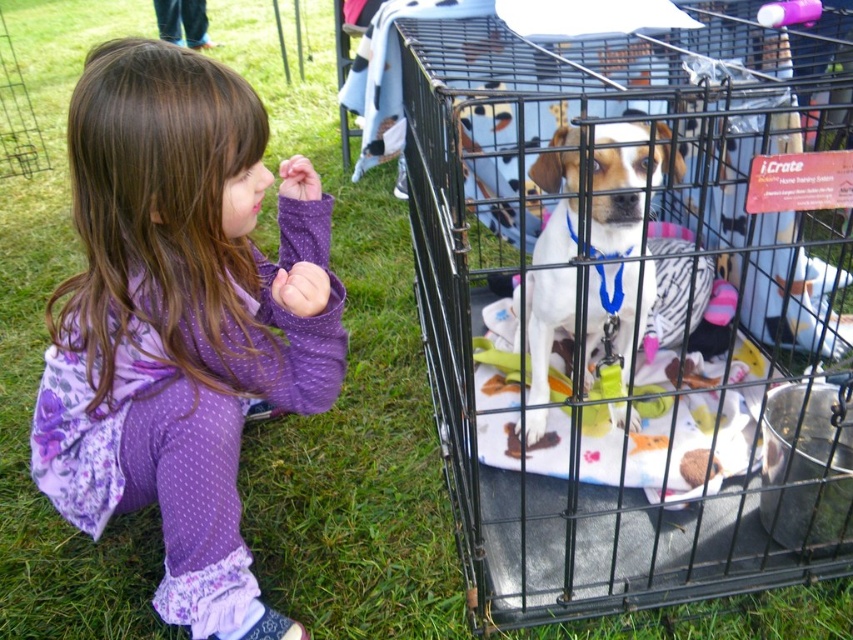
Question: Estimate the real-world distances between objects in this image. Which object is closer to the black wire cage at center?

Choices:
 (A) white fur dog at center
 (B) purple polka dot dress at lower left

Answer: (A)

Question: Which point is closer to the camera?

Choices:
 (A) black wire cage at center
 (B) white fur dog at center
 (C) purple polka dot dress at lower left

Answer: (A)

Question: Which point is farther from the camera taking this photo?

Choices:
 (A) (250, 384)
 (B) (642, 168)

Answer: (B)

Question: Considering the relative positions of black wire cage at center and white fur dog at center in the image provided, where is black wire cage at center located with respect to white fur dog at center?

Choices:
 (A) below
 (B) above

Answer: (B)

Question: Does purple polka dot dress at lower left come in front of white fur dog at center?

Choices:
 (A) no
 (B) yes

Answer: (A)

Question: Is purple polka dot dress at lower left to the right of white fur dog at center from the viewer's perspective?

Choices:
 (A) no
 (B) yes

Answer: (A)